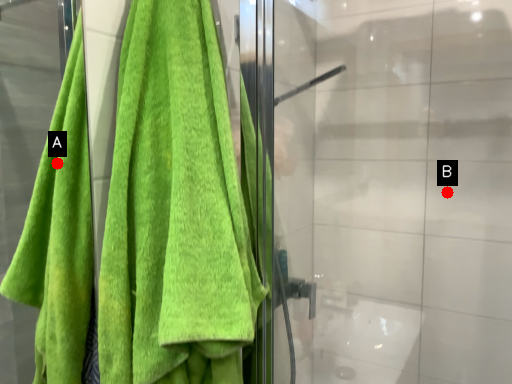
Question: Two points are circled on the image, labeled by A and B beside each circle. Which point is farther from the camera taking this photo?

Choices:
 (A) A is further
 (B) B is further

Answer: (A)